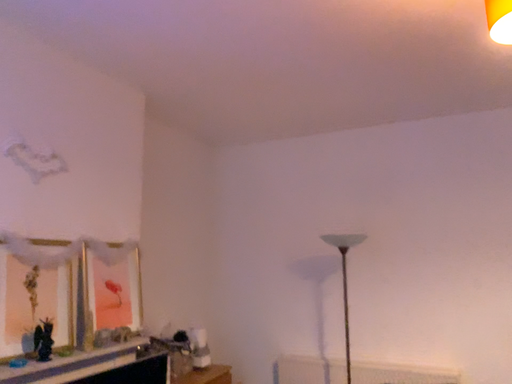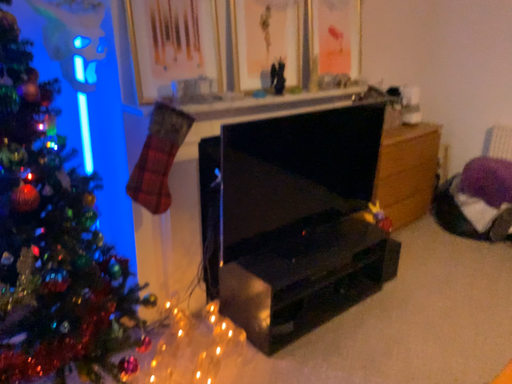
Question: How did the camera likely rotate when shooting the video?

Choices:
 (A) rotated left
 (B) rotated right

Answer: (A)